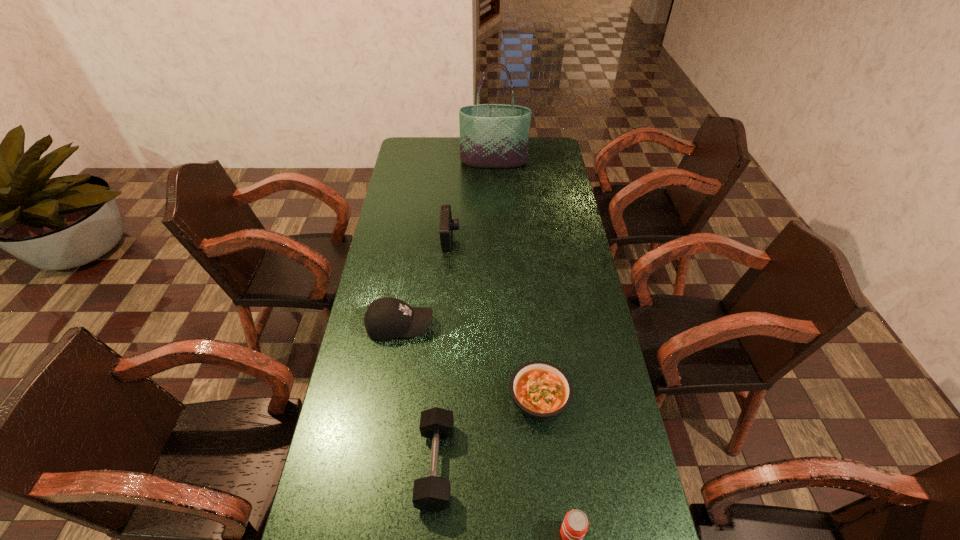
Identify the location of empty space that is in between the baseball cap and the camera. (425, 282).

You are a GUI agent. You are given a task and a screenshot of the screen. Output one action in this format:
    pyautogui.click(x=<x>, y=<y>)
    Task: Click on the vacant space that is in between the dumbbell and the stew
    Image resolution: width=960 pixels, height=540 pixels.
    Given the screenshot: What is the action you would take?
    pyautogui.click(x=488, y=431)

The width and height of the screenshot is (960, 540). I want to click on vacant area between the tallest object and the stew, so click(516, 280).

I want to click on the second closest object to the stew, so click(x=574, y=527).

Locate an element on the screen. The width and height of the screenshot is (960, 540). object identified as the second closest to the camera is located at coordinates (491, 135).

Locate an element on the screen. free space that satisfies the following two spatial constraints: 1. on the front-facing side of the shortest object; 2. on the left side of the baseball cap is located at coordinates (389, 399).

This screenshot has height=540, width=960. What are the coordinates of `free space that satisfies the following two spatial constraints: 1. on the front-facing side of the fourth nearest object; 2. on the right side of the dumbbell` in the screenshot? It's located at (378, 465).

Identify the location of vacant region that satisfies the following two spatial constraints: 1. on the front-facing side of the fourth nearest object; 2. on the right side of the dumbbell. (378, 465).

At what (x,y) coordinates should I click in order to perform the action: click on blank area in the image that satisfies the following two spatial constraints: 1. on the back side of the stew; 2. on the front-facing side of the baseball cap. Please return your answer as a coordinate pair (x, y). The width and height of the screenshot is (960, 540). Looking at the image, I should click on (x=532, y=326).

You are a GUI agent. You are given a task and a screenshot of the screen. Output one action in this format:
    pyautogui.click(x=<x>, y=<y>)
    Task: Click on the vacant point that satisfies the following two spatial constraints: 1. on the front-facing side of the stew; 2. on the left side of the second farthest object
    This screenshot has height=540, width=960.
    Given the screenshot: What is the action you would take?
    pyautogui.click(x=439, y=399)